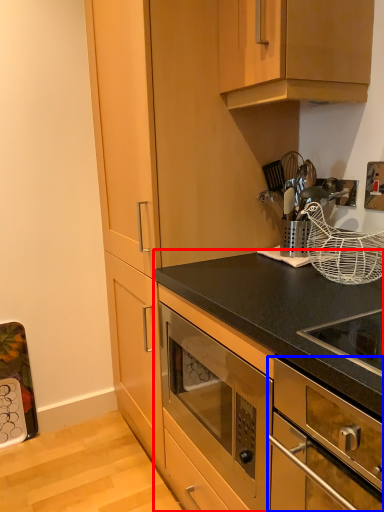
Question: Which object is closer to the camera taking this photo, cabinetry (highlighted by a red box) or oven (highlighted by a blue box)?

Choices:
 (A) cabinetry
 (B) oven

Answer: (B)